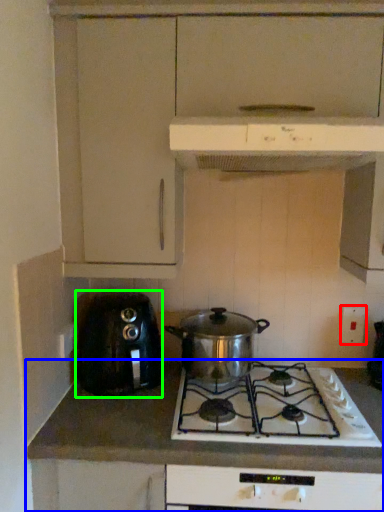
Question: Which object is the closest to the electric outlet (highlighted by a red box)? Choose among these: countertop (highlighted by a blue box) or toaster (highlighted by a green box).

Choices:
 (A) countertop
 (B) toaster

Answer: (A)